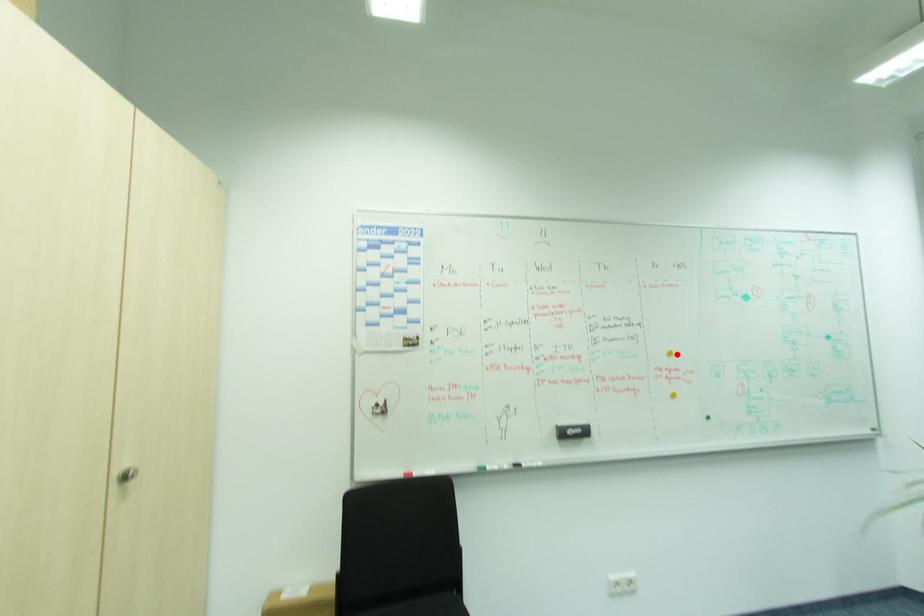
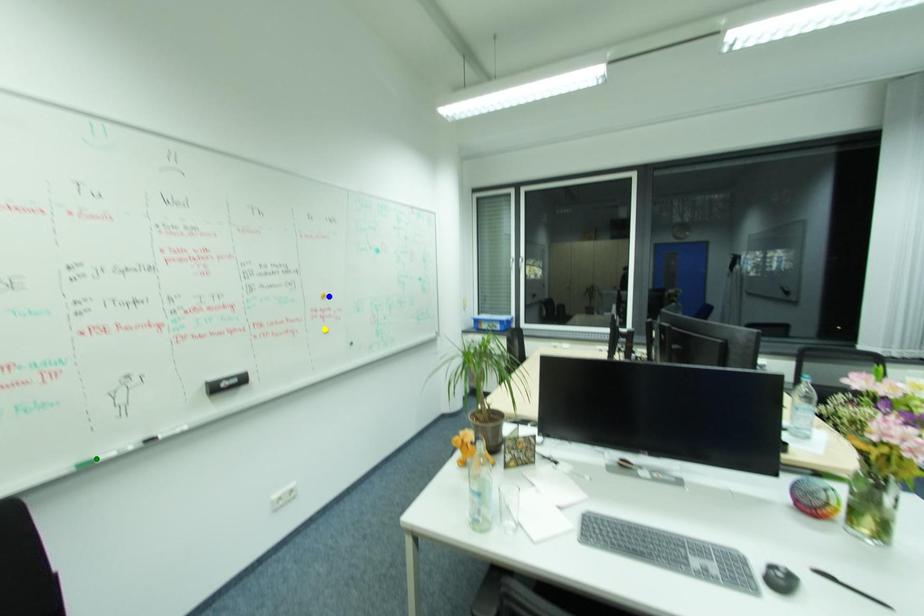
Question: I am providing you with two images of the same scene from different viewpoints. A red point is marked on the first image. You are given multiple points on the second image. Can you choose the point in image 2 that corresponds to the point in image 1?

Choices:
 (A) green point
 (B) yellow point
 (C) blue point

Answer: (C)